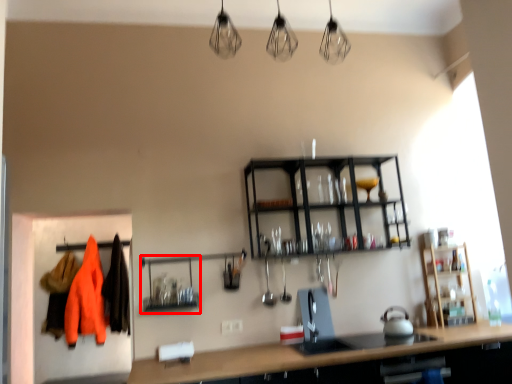
Question: Considering the relative positions of shelf (annotated by the red box) and clothing in the image provided, where is shelf (annotated by the red box) located with respect to the staircase?

Choices:
 (A) right
 (B) left

Answer: (A)